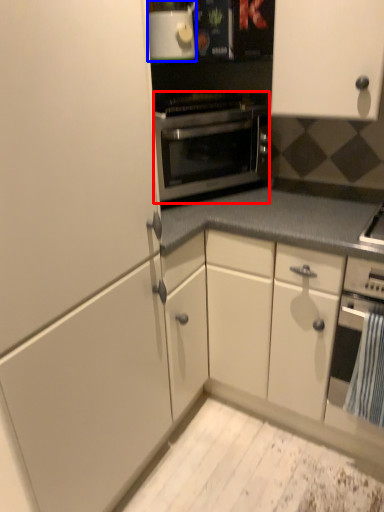
Question: Which point is further to the camera, oven (highlighted by a red box) or appliance (highlighted by a blue box)?

Choices:
 (A) oven
 (B) appliance

Answer: (A)